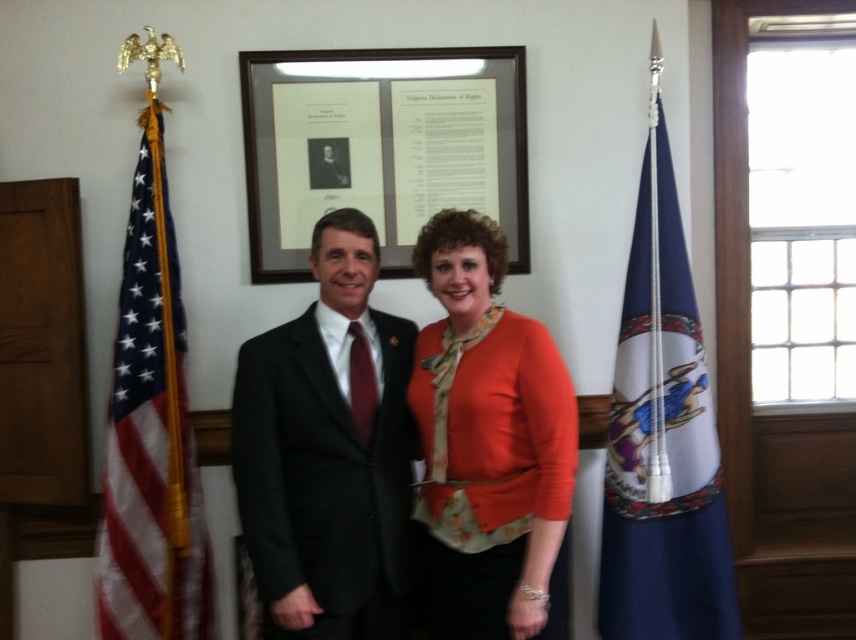
You are a photographer adjusting your camera settings to ensure both the orange matte sweater at center and the blue fabric flag at left are in focus. Considering their sizes, which object will require a closer focus adjustment to capture details?

The orange matte sweater at center has a larger size compared to the blue fabric flag at left, so it will require a closer focus adjustment to capture details.

You are a photographer setting up a shot for a group photo. You need to ensure that the blue fabric flag at right and the blue fabric flag at left are both visible in the frame. Based on their positions, which flag is higher in the image?

Result: The blue fabric flag at right is located above the blue fabric flag at left, so it is higher in the image.

You are a photographer trying to capture a group photo. You need to ensure that the orange matte sweater at center and the blue fabric flag at left are both visible in the frame. Given their sizes, which object might require you to adjust your camera angle to include it fully?

The orange matte sweater at center has a larger width than the blue fabric flag at left, so it might require adjusting the camera angle to ensure it is fully visible in the frame.